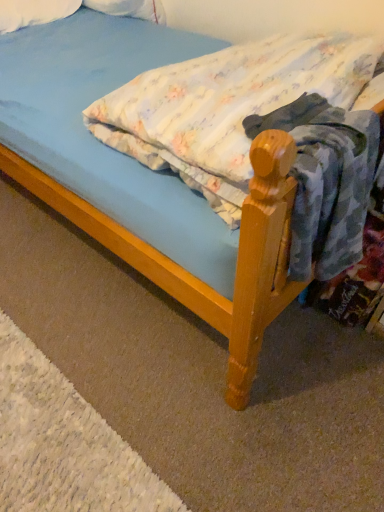
Question: From the image's perspective, is light blue fabric mattress at center positioned above or below white soft pillow at upper left?

Choices:
 (A) below
 (B) above

Answer: (A)

Question: From their relative heights in the image, would you say light blue fabric mattress at center is taller or shorter than white soft pillow at upper left?

Choices:
 (A) short
 (B) tall

Answer: (B)

Question: From a real-world perspective, is light blue fabric mattress at center positioned above or below white soft pillow at upper left?

Choices:
 (A) above
 (B) below

Answer: (A)

Question: From their relative heights in the image, would you say white soft pillow at upper left is taller or shorter than light blue fabric mattress at center?

Choices:
 (A) short
 (B) tall

Answer: (A)

Question: Is white soft pillow at upper left situated inside light blue fabric mattress at center or outside?

Choices:
 (A) inside
 (B) outside

Answer: (B)

Question: From the image's perspective, relative to light blue fabric mattress at center, is white soft pillow at upper left above or below?

Choices:
 (A) above
 (B) below

Answer: (A)

Question: In terms of width, does white soft pillow at upper left look wider or thinner when compared to light blue fabric mattress at center?

Choices:
 (A) wide
 (B) thin

Answer: (B)